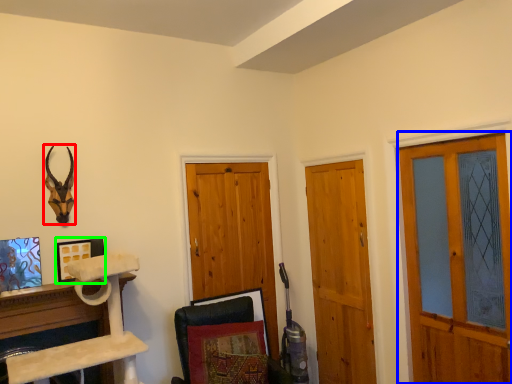
Question: Estimate the real-world distances between objects in this image. Which object is closer to animal (highlighted by a red box), screen door (highlighted by a blue box) or picture frame (highlighted by a green box)?

Choices:
 (A) screen door
 (B) picture frame

Answer: (B)